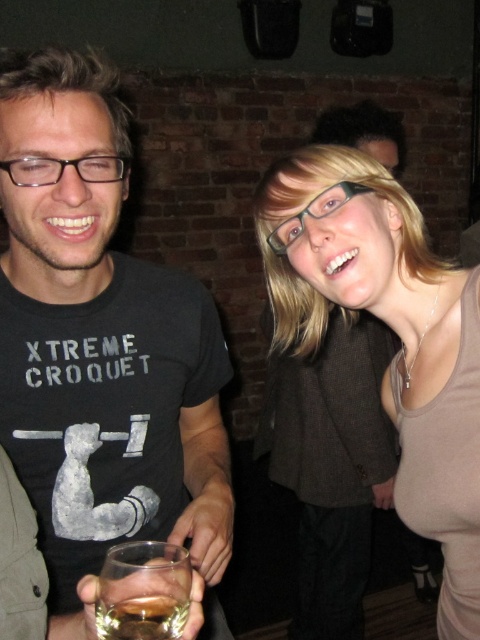
You are a photographer trying to capture the matte brown tank top at center in the image. Given that the camera is focused at point coordinates [394,332], can you confirm if the matte brown tank top at center is in focus?

Yes, the matte brown tank top at center is in focus because the camera is focused at point coordinates [394,332], which corresponds to the matte brown tank top at center.